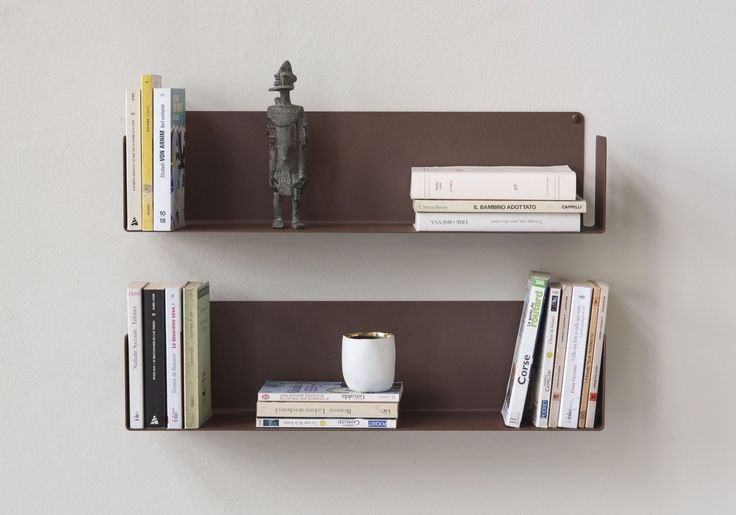
Where is `book on top shelf`? book on top shelf is located at coordinates (166, 148), (146, 153), (134, 151), (425, 183), (439, 208), (441, 226).